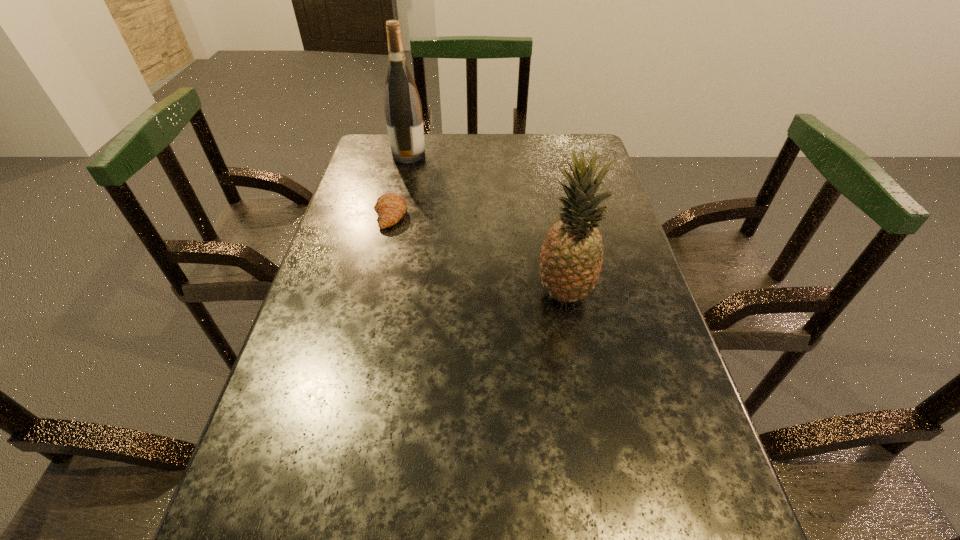
Find the location of a particular element. This screenshot has height=540, width=960. vacant area between the wine bottle and the pineapple is located at coordinates (487, 224).

The image size is (960, 540). Find the location of `object that is the closest to the second nearest object`. object that is the closest to the second nearest object is located at coordinates (403, 111).

Identify which object is located as the second nearest to the wine bottle. Please provide its 2D coordinates. Your answer should be formatted as a tuple, i.e. [(x, y)], where the tuple contains the x and y coordinates of a point satisfying the conditions above.

[(571, 257)]

Identify the location of free space that satisfies the following two spatial constraints: 1. on the front side of the second nearest object; 2. on the left side of the nearest object. The image size is (960, 540). (372, 293).

Where is `vacant space that satisfies the following two spatial constraints: 1. on the label of the wine bottle; 2. on the left side of the rightmost object`? Image resolution: width=960 pixels, height=540 pixels. vacant space that satisfies the following two spatial constraints: 1. on the label of the wine bottle; 2. on the left side of the rightmost object is located at coordinates (378, 293).

I want to click on vacant space that satisfies the following two spatial constraints: 1. on the label of the farthest object; 2. on the right side of the nearest object, so click(x=378, y=293).

Identify the location of free location that satisfies the following two spatial constraints: 1. on the back side of the pineapple; 2. on the label of the farthest object. The height and width of the screenshot is (540, 960). (540, 156).